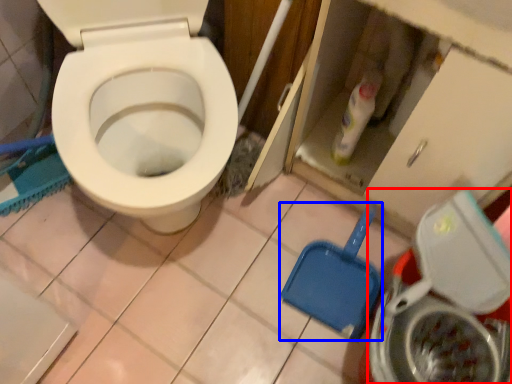
Question: Among these objects, which one is nearest to the camera, washing machine (highlighted by a red box) or shovel (highlighted by a blue box)?

Choices:
 (A) washing machine
 (B) shovel

Answer: (A)